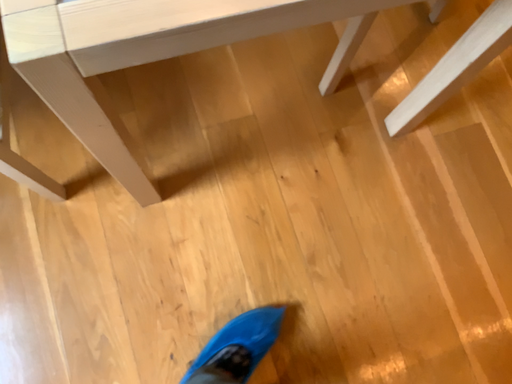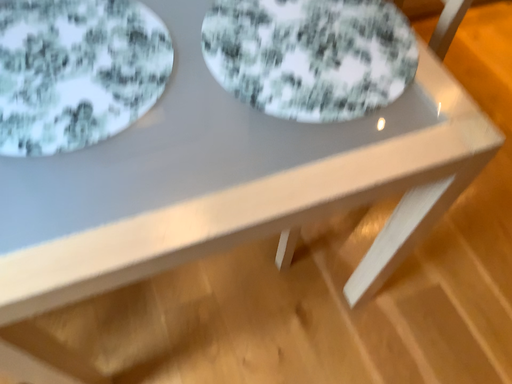
Question: Which way did the camera rotate in the video?

Choices:
 (A) rotated upward
 (B) rotated downward

Answer: (A)